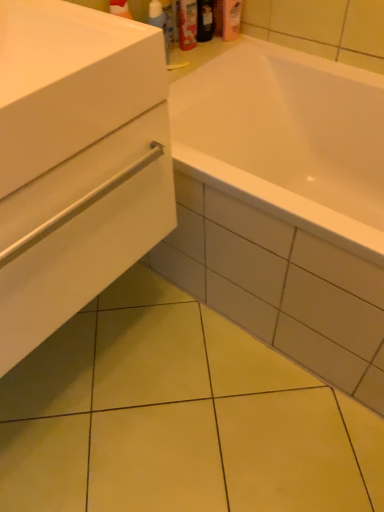
Question: Would you say translucent plastic spray bottle at upper center is to the left or to the right of pink matte lotion at upper center, marked as the 1th toiletry in a right-to-left arrangement, in the picture?

Choices:
 (A) right
 (B) left

Answer: (B)

Question: Is point (165, 27) positioned closer to the camera than point (228, 33)?

Choices:
 (A) farther
 (B) closer

Answer: (B)

Question: Estimate the real-world distances between objects in this image. Which object is farther from the white glossy sink at left?

Choices:
 (A) black glossy bottle at upper center, marked as the second toiletry in a right-to-left arrangement
 (B) translucent plastic spray bottle at upper center
 (C) matte plastic shampoo bottle at upper center, arranged as the 1th toiletry when viewed from the left
 (D) pink matte lotion at upper center, marked as the 1th toiletry in a right-to-left arrangement
 (E) white matte drawer at lower left

Answer: (D)

Question: Which is farther from the matte plastic shampoo bottle at upper center, arranged as the 1th toiletry when viewed from the left?

Choices:
 (A) white glossy sink at left
 (B) black glossy bottle at upper center, marked as the second toiletry in a right-to-left arrangement
 (C) translucent plastic spray bottle at upper center
 (D) pink matte lotion at upper center, placed as the third toiletry when sorted from left to right
 (E) white matte drawer at lower left

Answer: (E)